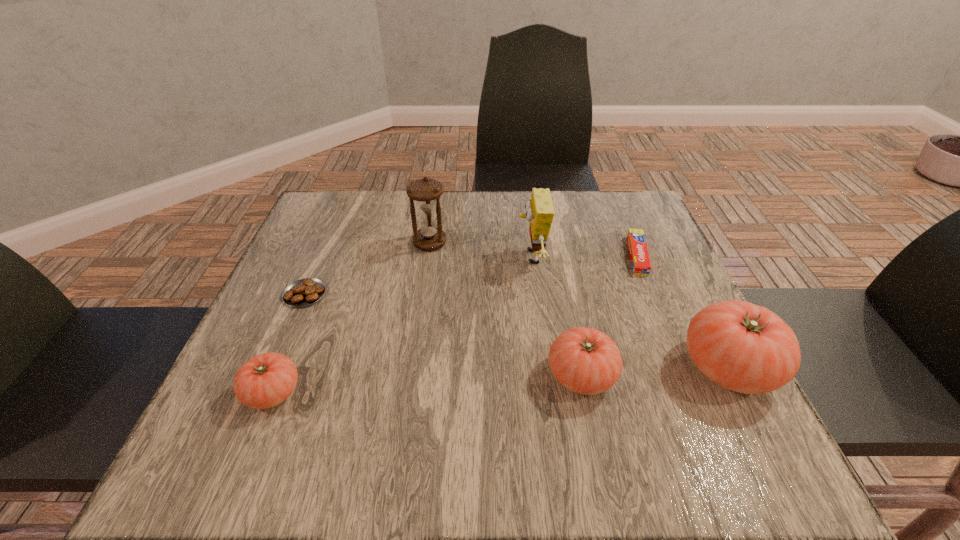
This screenshot has width=960, height=540. In order to click on vacant space located on the right of the leftmost tomato in this screenshot , I will do `click(434, 393)`.

You are a GUI agent. You are given a task and a screenshot of the screen. Output one action in this format:
    pyautogui.click(x=<x>, y=<y>)
    Task: Click on the free space located 0.330m on the back of the fourth tallest object
    Image resolution: width=960 pixels, height=540 pixels.
    Given the screenshot: What is the action you would take?
    pyautogui.click(x=554, y=242)

This screenshot has height=540, width=960. I want to click on vacant space located 0.400m on the back of the tallest tomato, so click(x=651, y=217).

Identify the location of vacant space located on the left of the toothpaste. (596, 255).

Locate an element on the screen. This screenshot has height=540, width=960. free spot located on the face of the sponge is located at coordinates (466, 258).

The image size is (960, 540). I want to click on free space located 0.220m on the face of the sponge, so click(422, 258).

The width and height of the screenshot is (960, 540). I want to click on free location located on the face of the sponge, so click(410, 258).

The image size is (960, 540). Identify the location of vacant position located on the right of the pastry. (497, 294).

This screenshot has height=540, width=960. I want to click on vacant area situated on the front of the third object from left to right, so click(412, 375).

Locate an element on the screen. The width and height of the screenshot is (960, 540). toothpaste situated at the far edge is located at coordinates (639, 256).